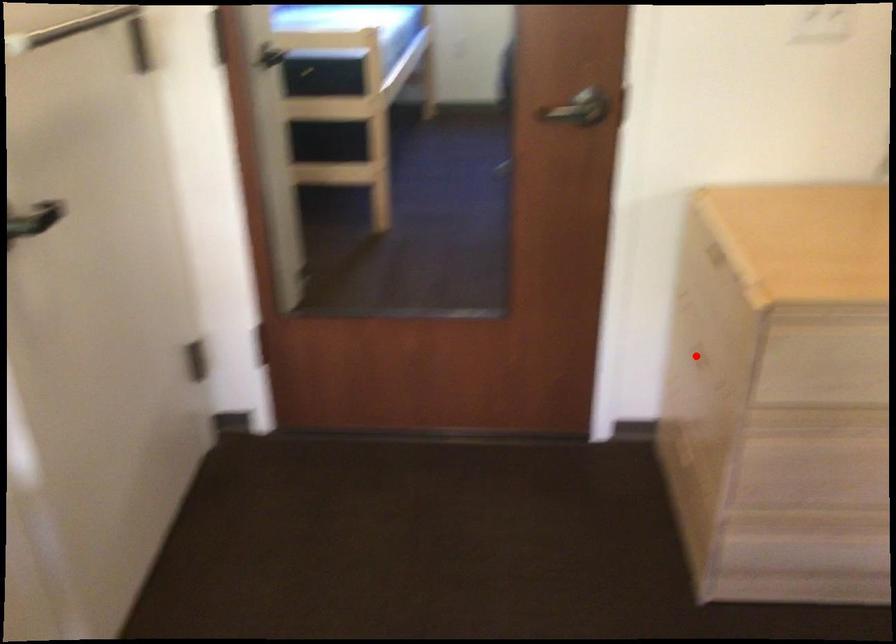
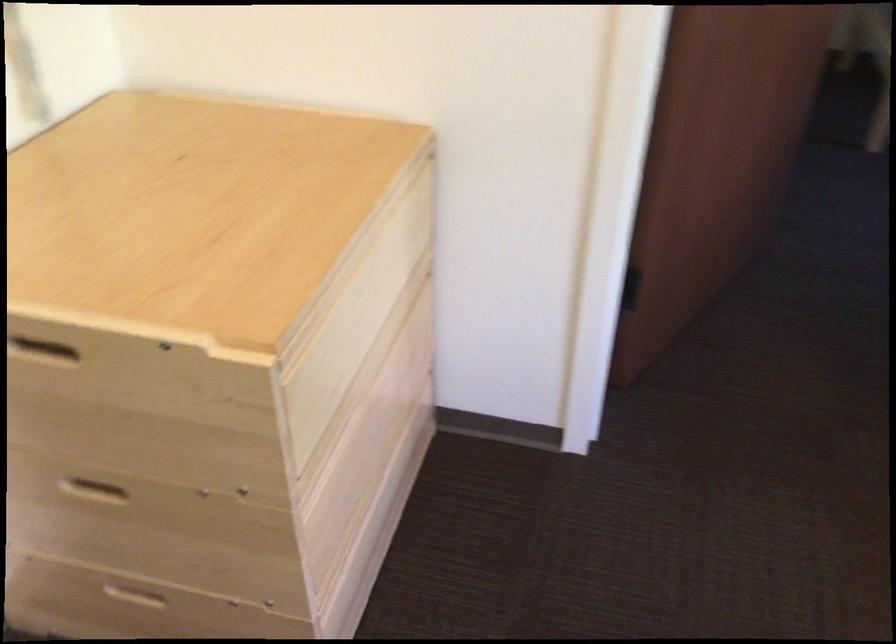
Question: I am providing you with two images of the same scene from different viewpoints. Given a red point in image1, look at the same physical point in image2. Is it:

Choices:
 (A) Closer to the viewpoint
 (B) Farther from the viewpoint

Answer: (A)